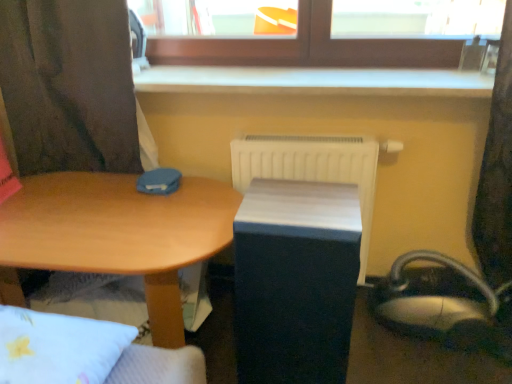
Question: From a real-world perspective, is matte black changing table at center above or below white plastic radiator at center?

Choices:
 (A) above
 (B) below

Answer: (B)

Question: From the image's perspective, is matte black changing table at center located above or below white plastic radiator at center?

Choices:
 (A) above
 (B) below

Answer: (B)

Question: Which object is positioned farthest from the matte black changing table at center?

Choices:
 (A) wooden desk at center
 (B) metallic silver swivel chair at lower right
 (C) transparent glass window at upper center
 (D) white plastic radiator at center

Answer: (C)

Question: Which of these objects is positioned closest to the matte black changing table at center?

Choices:
 (A) wooden desk at center
 (B) white plastic radiator at center
 (C) metallic silver swivel chair at lower right
 (D) transparent glass window at upper center

Answer: (A)